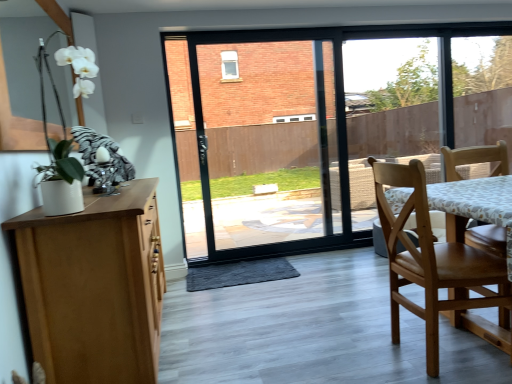
The image size is (512, 384). What do you see at coordinates (30, 73) in the screenshot?
I see `white matte orchid at upper left` at bounding box center [30, 73].

What is the approximate height of white matte orchid at upper left?

It is 37.91 inches.

The height and width of the screenshot is (384, 512). What are the coordinates of `white matte orchid at upper left` in the screenshot? It's located at (30, 73).

What do you see at coordinates (431, 260) in the screenshot? This screenshot has height=384, width=512. I see `wooden chair at right` at bounding box center [431, 260].

Locate an element on the screen. This screenshot has width=512, height=384. wooden chair at right is located at coordinates (431, 260).

Find the location of `white matte orchid at upper left`. white matte orchid at upper left is located at coordinates (30, 73).

From the picture: Which object is positioned more to the right, white matte orchid at upper left or wooden chair at right?

wooden chair at right.

Considering the positions of objects white matte orchid at upper left and wooden chair at right in the image provided, who is behind, white matte orchid at upper left or wooden chair at right?

wooden chair at right is behind.

Does point (24, 131) appear closer or farther from the camera than point (394, 288)?

Point (24, 131) appears to be closer to the viewer than point (394, 288).

From the image's perspective, which one is positioned lower, white matte orchid at upper left or wooden chair at right?

wooden chair at right, from the image's perspective.

From a real-world perspective, which is physically above, white matte orchid at upper left or wooden chair at right?

white matte orchid at upper left is physically above.

In terms of width, does white matte orchid at upper left look wider or thinner when compared to wooden chair at right?

white matte orchid at upper left is thinner than wooden chair at right.

Is white matte orchid at upper left taller or shorter than wooden chair at right?

Considering their sizes, white matte orchid at upper left has less height than wooden chair at right.

Considering the sizes of objects white matte orchid at upper left and wooden chair at right in the image provided, who is smaller, white matte orchid at upper left or wooden chair at right?

Smaller between the two is white matte orchid at upper left.

Is white matte orchid at upper left outside of wooden chair at right?

Yes, white matte orchid at upper left is outside of wooden chair at right.

From the picture: Can you see white matte orchid at upper left touching wooden chair at right?

No, white matte orchid at upper left is not next to wooden chair at right.

Is white matte orchid at upper left oriented away from wooden chair at right?

No.

Locate an element on the screen. The height and width of the screenshot is (384, 512). chair on the right of the white matte orchid at upper left is located at coordinates (431, 260).

Considering the relative positions of wooden chair at right and white matte orchid at upper left in the image provided, is wooden chair at right to the right of white matte orchid at upper left from the viewer's perspective?

Indeed, wooden chair at right is positioned on the right side of white matte orchid at upper left.

From the picture: Is wooden chair at right in front of white matte orchid at upper left?

No, wooden chair at right is further to the viewer.

Is point (449, 271) more distant than point (69, 18)?

No, it is not.

From the image's perspective, would you say wooden chair at right is shown under white matte orchid at upper left?

Yes, from the image's perspective, wooden chair at right is beneath white matte orchid at upper left.

From a real-world perspective, which is physically above, wooden chair at right or white matte orchid at upper left?

In real-world perspective, white matte orchid at upper left is above.

Looking at this image, can you confirm if wooden chair at right is thinner than white matte orchid at upper left?

Incorrect, the width of wooden chair at right is not less than that of white matte orchid at upper left.

Is wooden chair at right taller than white matte orchid at upper left?

Indeed, wooden chair at right has a greater height compared to white matte orchid at upper left.

Considering the sizes of objects wooden chair at right and white matte orchid at upper left in the image provided, who is smaller, wooden chair at right or white matte orchid at upper left?

With smaller size is white matte orchid at upper left.

Is wooden chair at right positioned beyond the bounds of white matte orchid at upper left?

Yes, wooden chair at right is located beyond the bounds of white matte orchid at upper left.

Would you say wooden chair at right is a long distance from white matte orchid at upper left?

wooden chair at right is positioned a significant distance from white matte orchid at upper left.

Could you tell me if wooden chair at right is facing white matte orchid at upper left?

No, wooden chair at right is not turned towards white matte orchid at upper left.

What's the angular difference between wooden chair at right and white matte orchid at upper left's facing directions?

The facing directions of wooden chair at right and white matte orchid at upper left are 0.0823 degrees apart.

Locate an element on the screen. chair behind the white matte orchid at upper left is located at coordinates (431, 260).

Locate an element on the screen. window screen located above the wooden chair at right (from the image's perspective) is located at coordinates (30, 73).

Where is `chair below the white matte orchid at upper left (from the image's perspective)`? Image resolution: width=512 pixels, height=384 pixels. chair below the white matte orchid at upper left (from the image's perspective) is located at coordinates (431, 260).